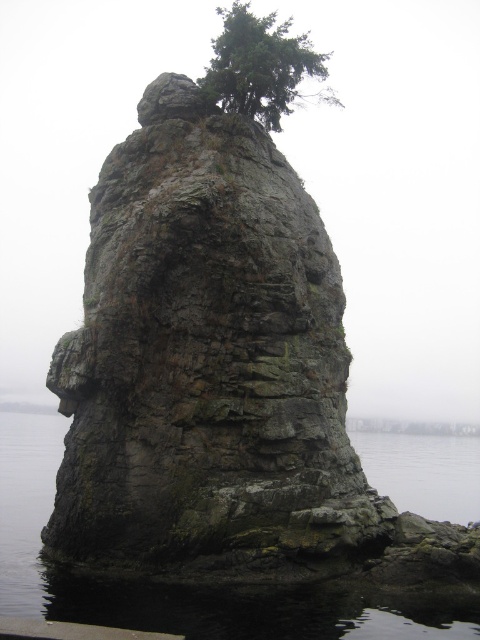
Question: Is dark gray water at lower center in front of green rough textured tree at upper center?

Choices:
 (A) no
 (B) yes

Answer: (B)

Question: Is dark gray water at lower center in front of transparent water at lower right?

Choices:
 (A) yes
 (B) no

Answer: (A)

Question: Can you confirm if dark gray water at lower center is positioned above green rough textured tree at upper center?

Choices:
 (A) no
 (B) yes

Answer: (A)

Question: Which is farther from the green rough textured tree at upper center?

Choices:
 (A) dark gray water at lower center
 (B) gray rough rock at center
 (C) transparent water at lower right

Answer: (C)

Question: Which of the following is the closest to the observer?

Choices:
 (A) (363, 454)
 (B) (235, 481)
 (C) (23, 561)

Answer: (B)

Question: Among these objects, which one is farthest from the camera?

Choices:
 (A) gray rough rock at center
 (B) green rough textured tree at upper center
 (C) transparent water at lower right

Answer: (B)